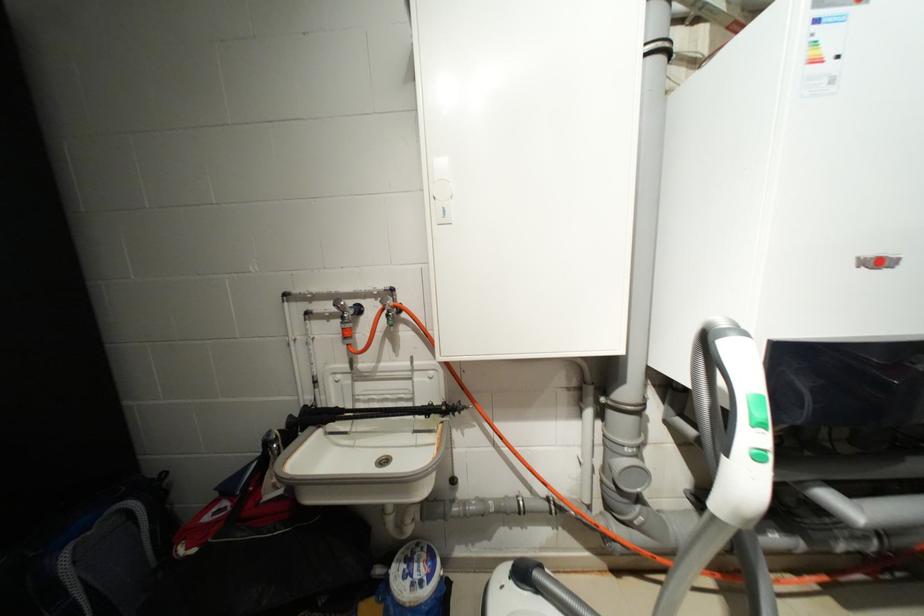
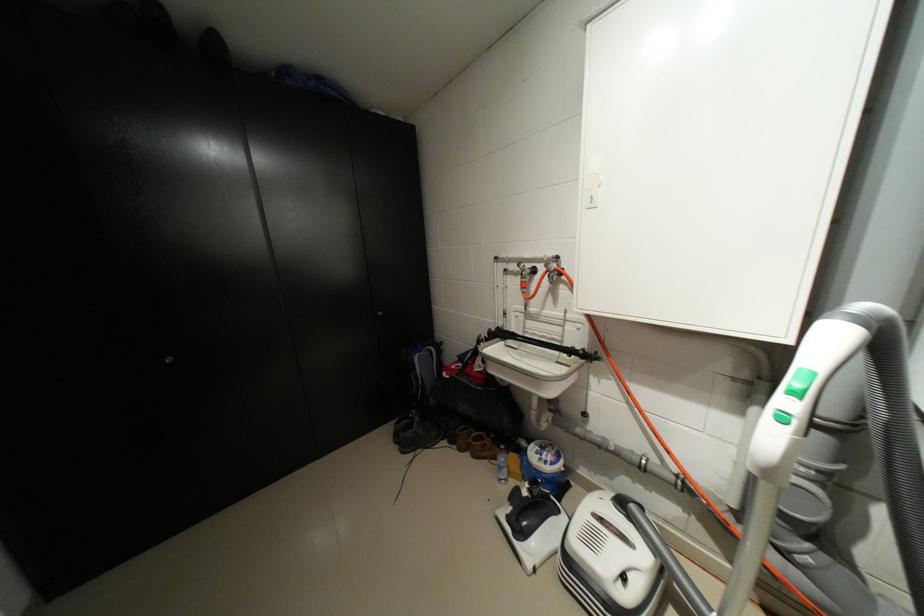
Question: The images are taken continuously from a first-person perspective. In which direction is your viewpoint rotating?

Choices:
 (A) Left
 (B) Right
 (C) Up
 (D) Down

Answer: (A)